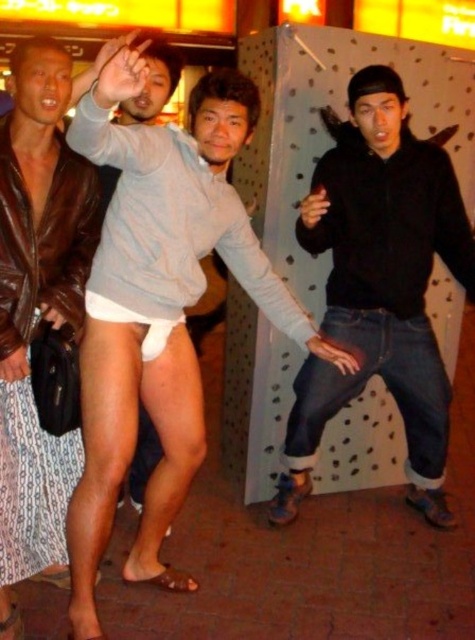
From the picture: Does black matte hoodie at center appear on the right side of white fabric underwear at center?

Yes, black matte hoodie at center is to the right of white fabric underwear at center.

Is black matte hoodie at center in front of white fabric underwear at center?

No, black matte hoodie at center is further to the viewer.

Between point (393, 131) and point (92, 308), which one is positioned behind?

The point (393, 131) is behind.

Identify the location of black matte hoodie at center. [x=380, y=285].

Is white matte underwear at center smaller than brown leather jacket at left?

Incorrect, white matte underwear at center is not smaller in size than brown leather jacket at left.

Which is behind, point (246, 140) or point (56, 458)?

Point (56, 458)

Does point (233, 76) lie behind point (21, 212)?

That is False.

Find the location of a particular element. white matte underwear at center is located at coordinates (131, 454).

Does white matte underwear at center appear on the right side of black matte hoodie at center?

In fact, white matte underwear at center is to the left of black matte hoodie at center.

Consider the image. Is white matte underwear at center closer to the viewer compared to black matte hoodie at center?

Yes, white matte underwear at center is closer to the viewer.

Locate an element on the screen. The image size is (475, 640). white matte underwear at center is located at coordinates (131, 454).